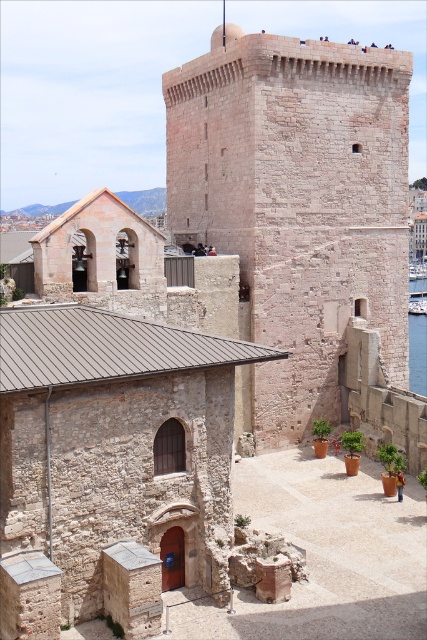
Question: Is rustic stone tower at center bigger than clear blue water at right?

Choices:
 (A) no
 (B) yes

Answer: (A)

Question: Which point is farther to the camera?

Choices:
 (A) (301, 138)
 (B) (420, 332)

Answer: (B)

Question: Does rustic stone tower at center appear under clear blue water at right?

Choices:
 (A) no
 (B) yes

Answer: (A)

Question: Which point is farther to the camera?

Choices:
 (A) rustic stone tower at center
 (B) clear blue water at right

Answer: (B)

Question: Can you confirm if rustic stone tower at center is wider than clear blue water at right?

Choices:
 (A) yes
 (B) no

Answer: (B)

Question: Which point is closer to the camera taking this photo?

Choices:
 (A) (409, 353)
 (B) (278, 86)

Answer: (B)